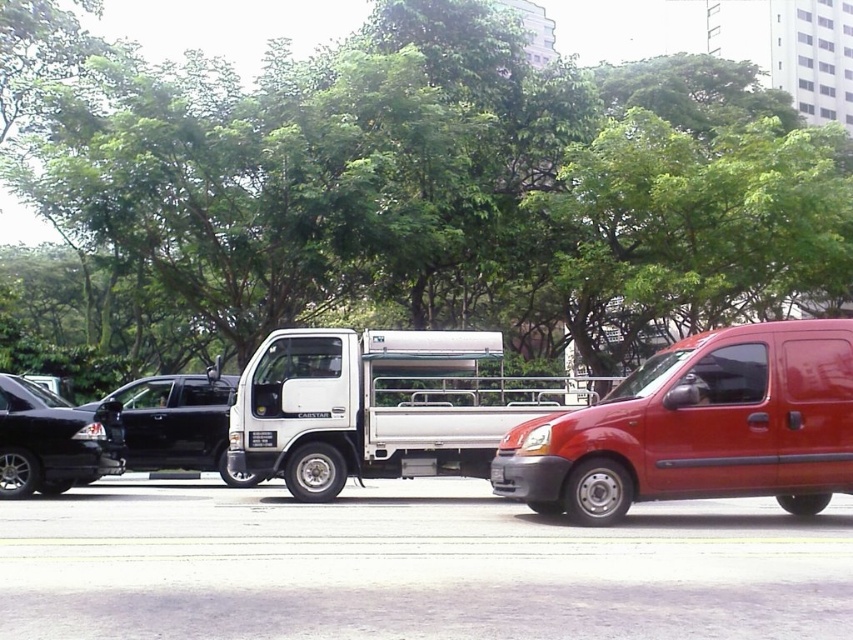
Is green leafy tree at upper center wider than shiny black sedan at left?

Indeed, green leafy tree at upper center has a greater width compared to shiny black sedan at left.

Is green leafy tree at upper center positioned at the back of shiny black sedan at left?

Yes, green leafy tree at upper center is further from the viewer.

You are a GUI agent. You are given a task and a screenshot of the screen. Output one action in this format:
    pyautogui.click(x=<x>, y=<y>)
    Task: Click on the green leafy tree at upper center
    
    Given the screenshot: What is the action you would take?
    pyautogui.click(x=408, y=188)

You are a GUI agent. You are given a task and a screenshot of the screen. Output one action in this format:
    pyautogui.click(x=<x>, y=<y>)
    Task: Click on the green leafy tree at upper center
    
    Given the screenshot: What is the action you would take?
    pyautogui.click(x=408, y=188)

How much distance is there between glossy red van at center and white matte truck at center?

A distance of 9.04 feet exists between glossy red van at center and white matte truck at center.

Who is taller, glossy red van at center or white matte truck at center?

glossy red van at center is taller.

This screenshot has width=853, height=640. In order to click on glossy red van at center in this screenshot , I will do `click(698, 428)`.

How far apart are green leafy tree at upper center and white matte truck at center?

green leafy tree at upper center and white matte truck at center are 17.44 meters apart.

Who is higher up, green leafy tree at upper center or white matte truck at center?

green leafy tree at upper center is higher up.

Find the location of a particular element. The height and width of the screenshot is (640, 853). green leafy tree at upper center is located at coordinates (408, 188).